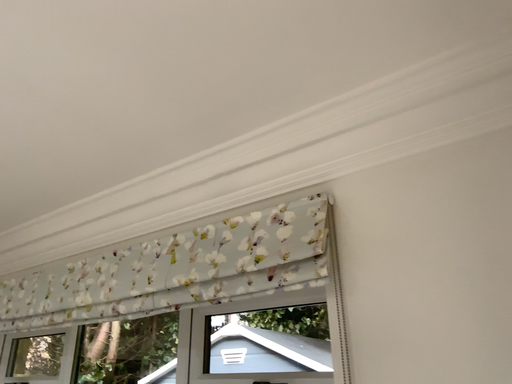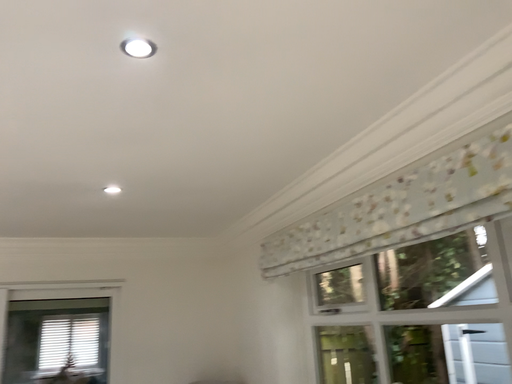
Question: Which way did the camera rotate in the video?

Choices:
 (A) rotated downward
 (B) rotated upward

Answer: (A)